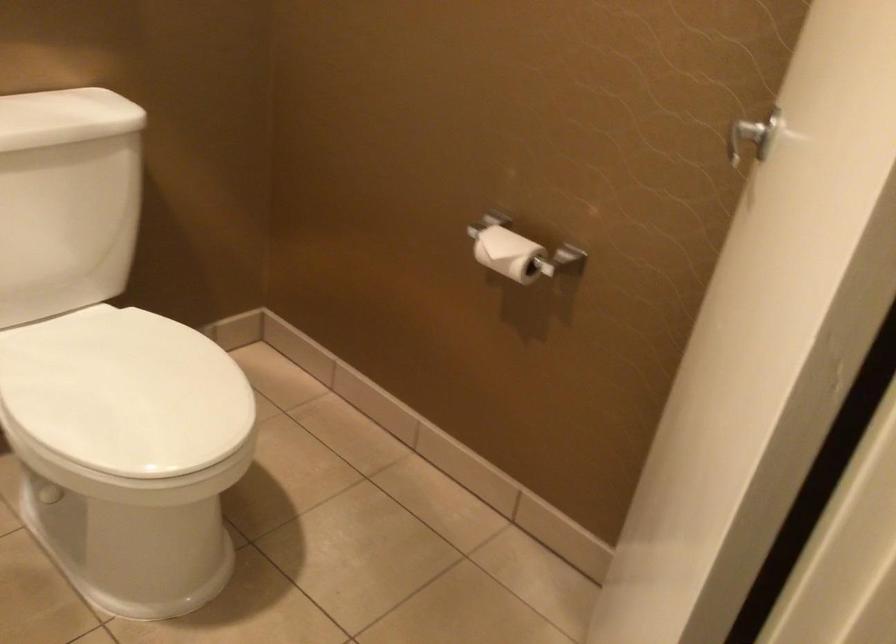
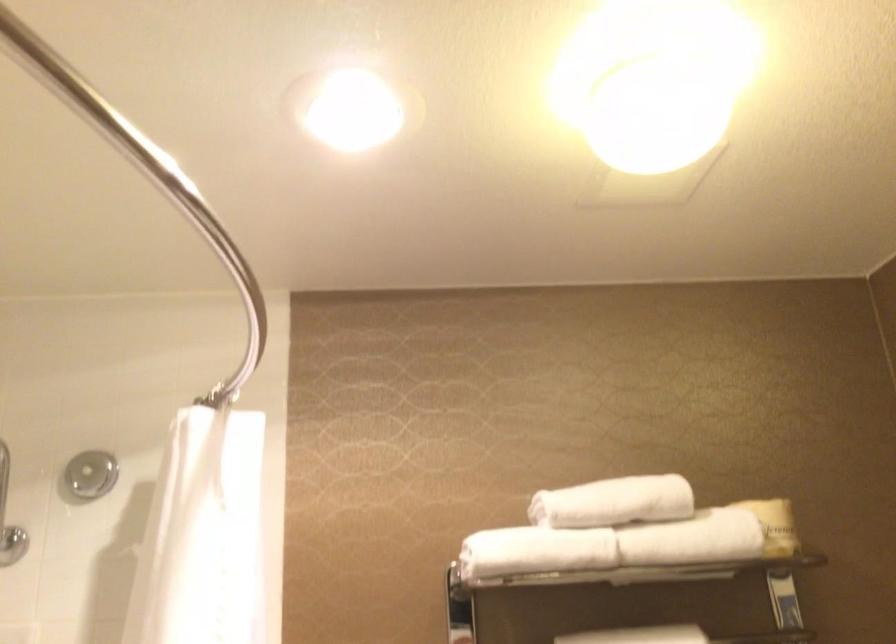
The images are taken continuously from a first-person perspective. In which direction is your viewpoint rotating?

The camera's rotation is toward left-up.